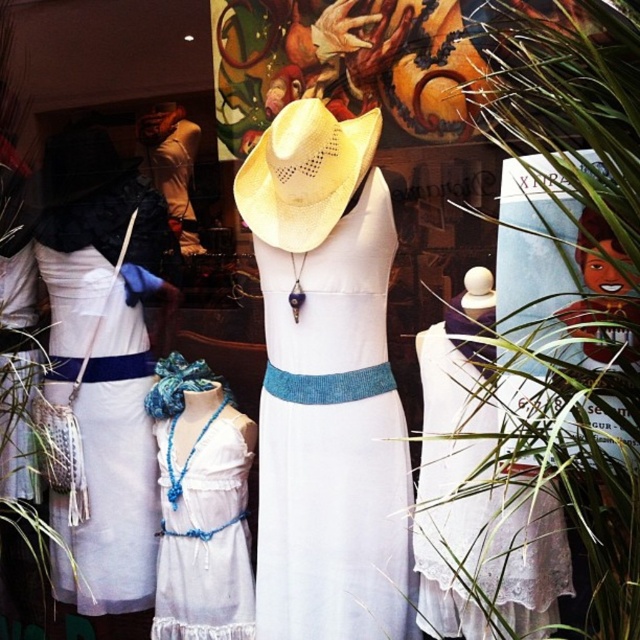
Question: Is white lace dress at center in front of white crochet dress at center?

Choices:
 (A) yes
 (B) no

Answer: (A)

Question: Does green leafy plant at center appear on the right side of white woven fabric dress at left?

Choices:
 (A) no
 (B) yes

Answer: (B)

Question: Is white knitted dress at center above natural straw cowboy hat at center?

Choices:
 (A) no
 (B) yes

Answer: (A)

Question: Which of the following is the farthest from the observer?

Choices:
 (A) (332, 250)
 (B) (493, 428)
 (C) (632, 38)
 (D) (264, 152)

Answer: (D)

Question: Which is nearer to the white woven fabric dress at left?

Choices:
 (A) white crochet dress at center
 (B) white knitted dress at center
 (C) natural straw cowboy hat at center

Answer: (A)

Question: Estimate the real-world distances between objects in this image. Which object is closer to the natural straw cowboy hat at center?

Choices:
 (A) white woven fabric dress at left
 (B) white lace dress at center
 (C) white crochet dress at center

Answer: (B)